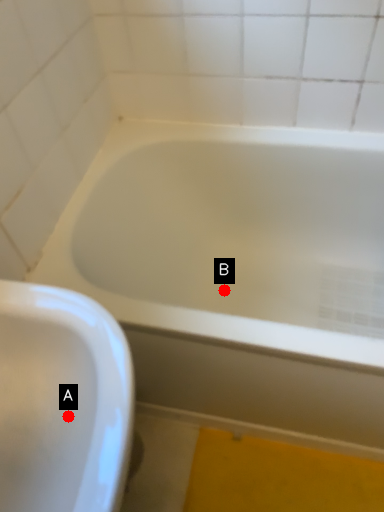
Question: Two points are circled on the image, labeled by A and B beside each circle. Among these points, which one is nearest to the camera?

Choices:
 (A) A is closer
 (B) B is closer

Answer: (A)